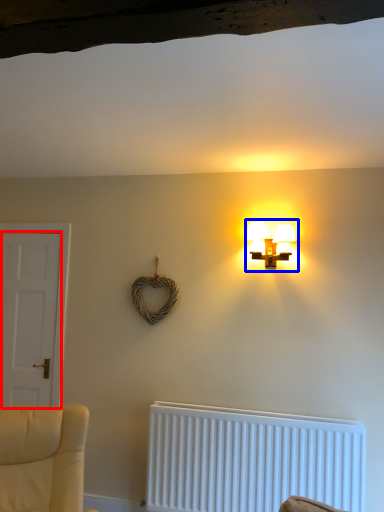
Question: Among these objects, which one is nearest to the camera, door (highlighted by a red box) or lamp (highlighted by a blue box)?

Choices:
 (A) door
 (B) lamp

Answer: (B)